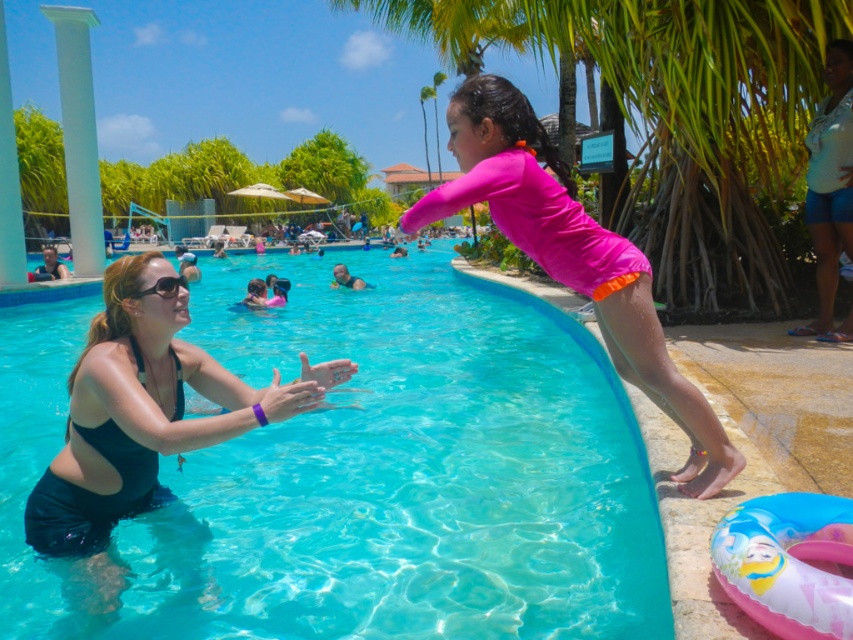
You are a photographer trying to capture a photo of the green leafy palm tree at upper center and the black rubber goggles at upper center. Which object should you focus on first if you want to ensure both are in focus without adjusting your camera settings?

The green leafy palm tree at upper center is taller than the black rubber goggles at upper center, so focusing on the taller object first would help ensure both are in focus.

You are a photographer trying to capture a clear shot of the black rubber goggles at upper center without the green leafy palm tree at upper center blocking it. Based on their positions, is this possible?

The green leafy palm tree at upper center might be wider than black rubber goggles at upper center, so there is a chance the palm tree could block the view of the goggles depending on their exact positioning. To ensure a clear shot, you might need to adjust your angle or position to avoid the tree.

You are a lifeguard at the pool and need to locate the swimmer wearing the black matte swimsuit at left. Based on the coordinates provided, can you determine their exact location in the pool area?

The black matte swimsuit at left is located at coordinates point [141,422].